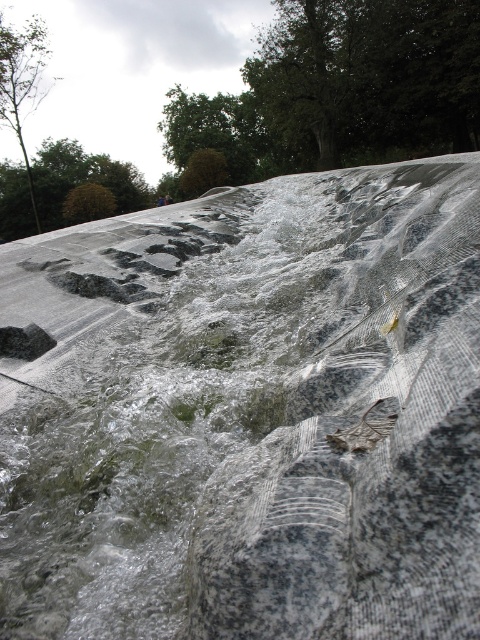
Question: Observing the image, what is the correct spatial positioning of green leafy tree at upper center in reference to green leafy tree at upper left?

Choices:
 (A) right
 (B) left

Answer: (A)

Question: Is green leafy tree at upper center above green leafy tree at upper left?

Choices:
 (A) no
 (B) yes

Answer: (B)

Question: Which of the following is the closest to the observer?

Choices:
 (A) (273, 144)
 (B) (26, 212)

Answer: (B)

Question: Which of the following is the farthest from the observer?

Choices:
 (A) brown leafy tree at upper left
 (B) green leafy tree at upper center
 (C) green leafy tree at upper left

Answer: (A)

Question: Can you confirm if green leafy tree at upper center is positioned above brown leafy tree at upper left?

Choices:
 (A) yes
 (B) no

Answer: (A)

Question: Which object is the closest to the green leafy tree at upper left?

Choices:
 (A) green leafy tree at upper center
 (B) brown leafy tree at upper left

Answer: (B)